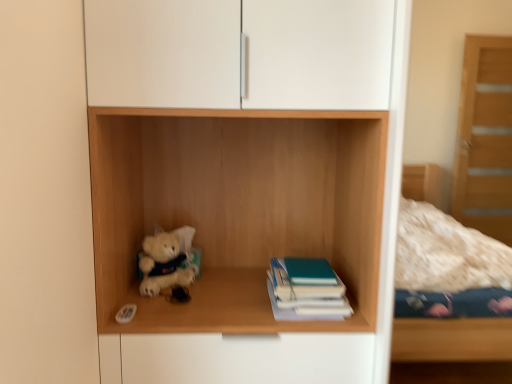
Where is `blank space above teal matte book at center (from a real-world perspective)`? blank space above teal matte book at center (from a real-world perspective) is located at coordinates [305, 264].